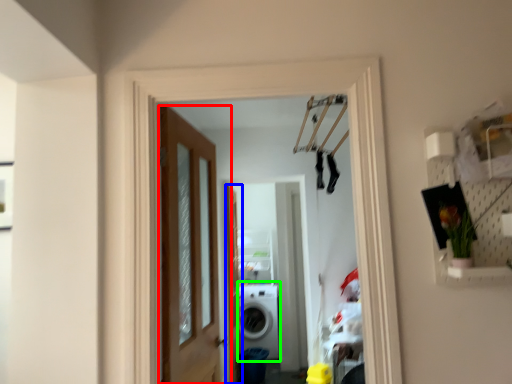
Question: Estimate the real-world distances between objects in this image. Which object is farther from door (highlighted by a red box), screen door (highlighted by a blue box) or washing machine (highlighted by a green box)?

Choices:
 (A) screen door
 (B) washing machine

Answer: (B)